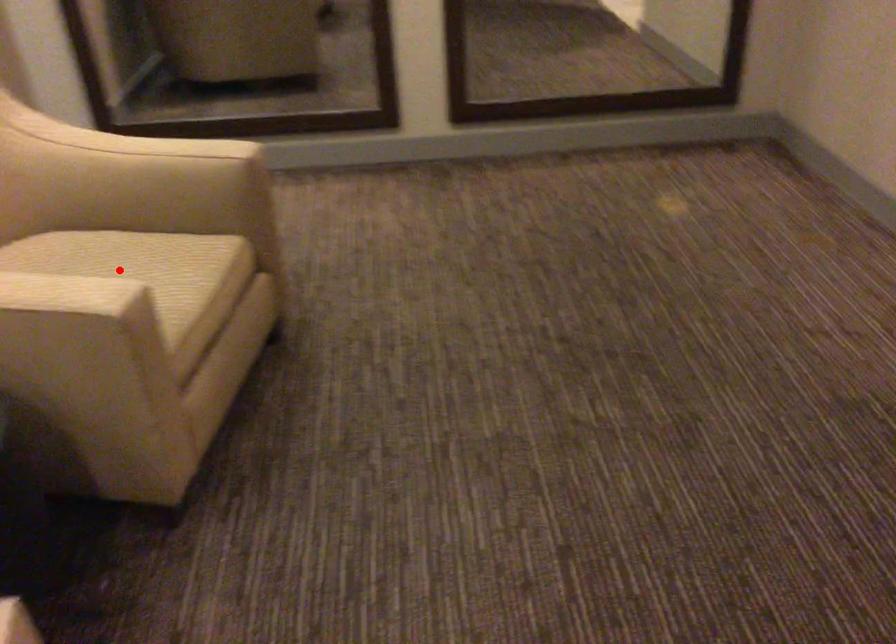
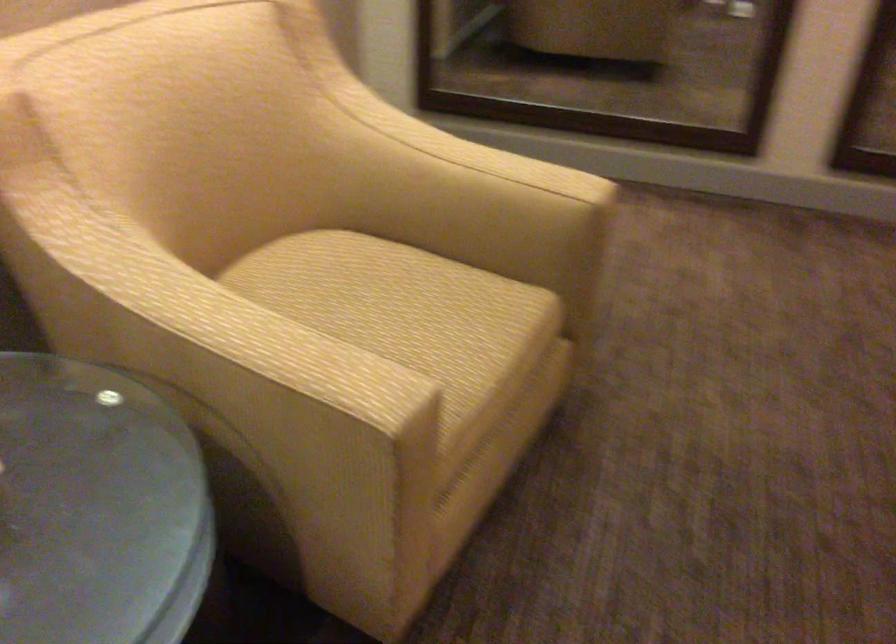
Question: I am providing you with two images of the same scene from different viewpoints. Image1 has a red point marked. In image2, the corresponding 3D location appears at what relative position? Reply with the corresponding letter.

Choices:
 (A) Closer
 (B) Farther

Answer: (A)